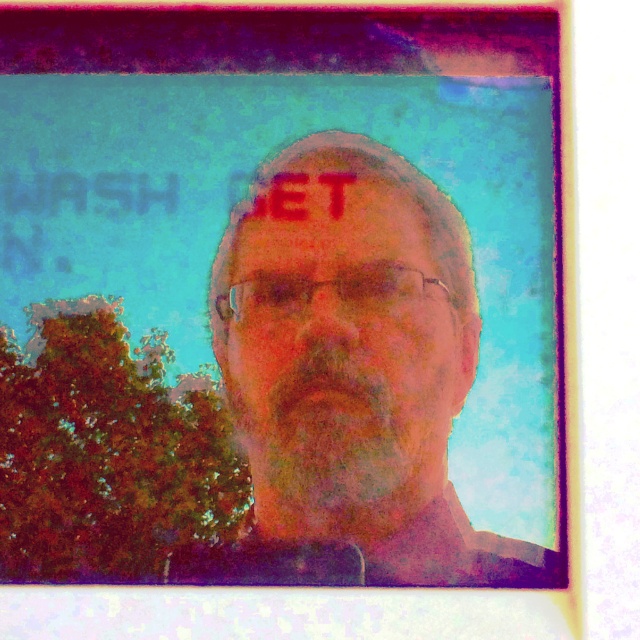
Question: Can you confirm if matte black face at center is positioned to the right of matte skin at center?

Choices:
 (A) yes
 (B) no

Answer: (A)

Question: Is matte black face at center thinner than matte skin at center?

Choices:
 (A) no
 (B) yes

Answer: (A)

Question: Among these objects, which one is nearest to the camera?

Choices:
 (A) matte skin face at center
 (B) matte black face at center

Answer: (B)

Question: Is matte black face at center wider than matte skin at center?

Choices:
 (A) no
 (B) yes

Answer: (B)

Question: Which object appears farthest from the camera in this image?

Choices:
 (A) matte skin face at center
 (B) matte skin at center

Answer: (B)

Question: Estimate the real-world distances between objects in this image. Which object is closer to the matte skin face at center?

Choices:
 (A) matte skin at center
 (B) matte black face at center

Answer: (B)